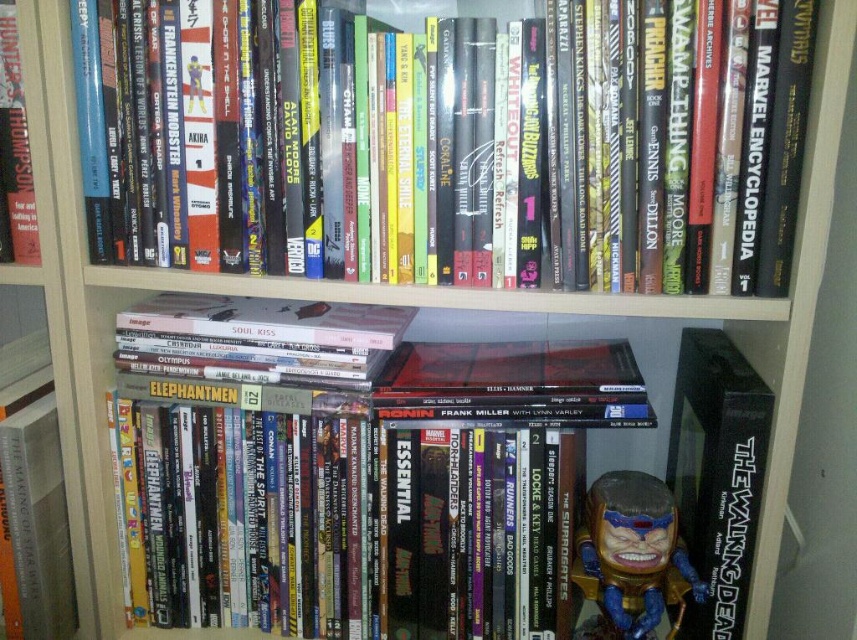
You are organizing books on a shelf and need to place a new book between the hardcover books at upper center and the black matte book at center. The new book is 10 inches thick. Will it fit in the space between them?

The distance between the hardcover books at upper center and the black matte book at center is 11.04 inches. Since the new book is 10 inches thick, it will fit in the space between them.

You are organizing a bookshelf and notice the hardcover books at upper center and the black matte book at center. Which book is closer to you when you are standing in front of the shelf?

The hardcover books at upper center are closer to you because they are in front of the black matte book at center.

You are standing in front of a bookshelf filled with various books and comics. You notice two points marked on the bookshelf. The first point is at coordinates point (654, 620), and the second point is at point (9, 120). Which of these two points is closer to you?

Point (654, 620) is in front of point (9, 120), so the first point is closer to you.